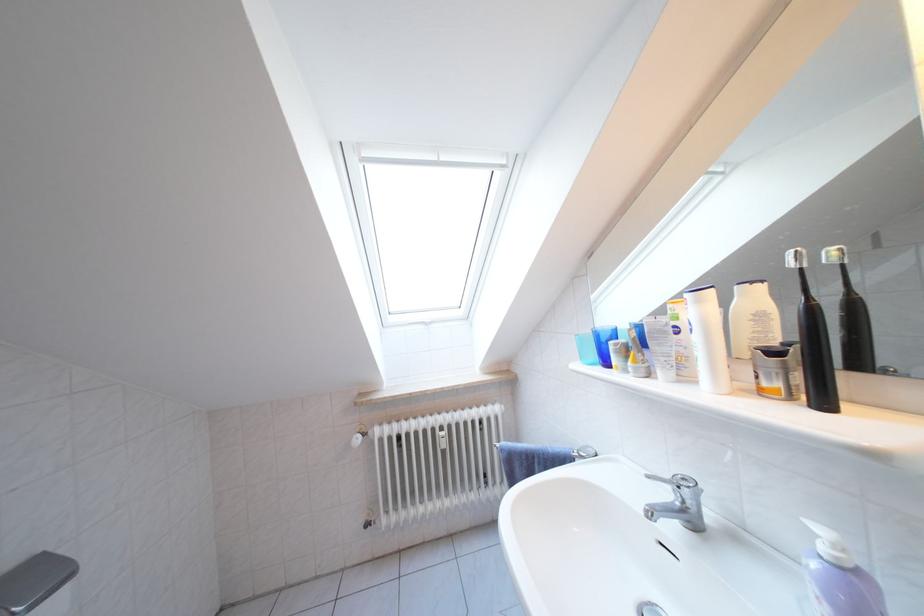
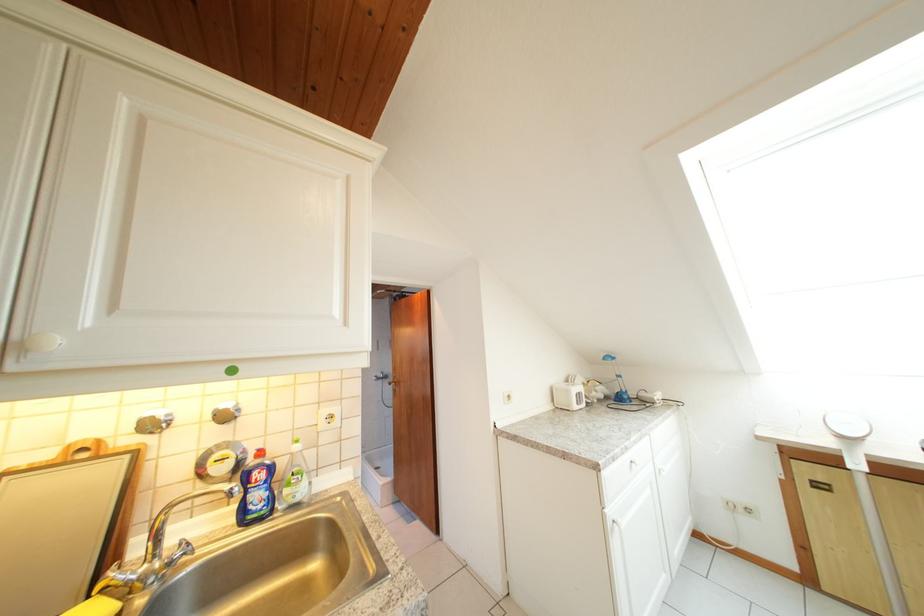
Question: I am providing you with two images of the same scene from different viewpoints. Which of the following objects are not visible in image2?

Choices:
 (A) silver deodorant can
 (B) white soap bottle
 (C) cabinet drawer knob
 (D) shower faucet handle

Answer: (A)